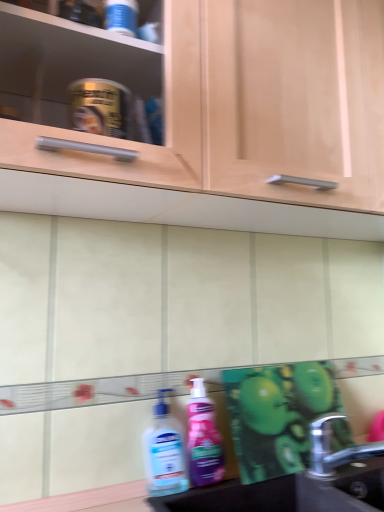
What do you see at coordinates (250, 104) in the screenshot?
I see `matte wood cabinet at upper center` at bounding box center [250, 104].

You are a GUI agent. You are given a task and a screenshot of the screen. Output one action in this format:
    pyautogui.click(x=<x>, y=<y>)
    Task: Click on the matte wood cabinet at upper center
    
    Given the screenshot: What is the action you would take?
    pyautogui.click(x=250, y=104)

Where is `pink glossy lotion at lower center, which is counted as the second cleaning product, starting from the left`? The width and height of the screenshot is (384, 512). pink glossy lotion at lower center, which is counted as the second cleaning product, starting from the left is located at coordinates (203, 438).

The height and width of the screenshot is (512, 384). Find the location of `translucent plastic hand sanitizer at lower center, arranged as the first cleaning product when viewed from the left`. translucent plastic hand sanitizer at lower center, arranged as the first cleaning product when viewed from the left is located at coordinates (164, 452).

Find the location of a particular element. This screenshot has width=384, height=512. matte wood cabinet at upper center is located at coordinates (250, 104).

Looking at the image, does translucent plastic hand sanitizer at lower center, which ranks as the 2th cleaning product in right-to-left order, seem bigger or smaller compared to silver metallic faucet at lower right?

translucent plastic hand sanitizer at lower center, which ranks as the 2th cleaning product in right-to-left order, is smaller than silver metallic faucet at lower right.

Looking at this image, from a real-world perspective, is translucent plastic hand sanitizer at lower center, arranged as the first cleaning product when viewed from the left, positioned under silver metallic faucet at lower right based on gravity?

No.

Is translucent plastic hand sanitizer at lower center, arranged as the first cleaning product when viewed from the left, inside or outside of silver metallic faucet at lower right?

translucent plastic hand sanitizer at lower center, arranged as the first cleaning product when viewed from the left, is not inside silver metallic faucet at lower right, it's outside.

Is translucent plastic hand sanitizer at lower center, which ranks as the 2th cleaning product in right-to-left order, shorter than silver metallic faucet at lower right?

No.

Does translucent plastic hand sanitizer at lower center, arranged as the first cleaning product when viewed from the left, come in front of pink glossy lotion at lower center, marked as the first cleaning product in a right-to-left arrangement?

Yes, the depth of translucent plastic hand sanitizer at lower center, arranged as the first cleaning product when viewed from the left, is less than that of pink glossy lotion at lower center, marked as the first cleaning product in a right-to-left arrangement.

Identify the location of cleaning product located above the translucent plastic hand sanitizer at lower center, arranged as the first cleaning product when viewed from the left (from a real-world perspective). The width and height of the screenshot is (384, 512). (203, 438).

Looking at this image, from the image's perspective, relative to pink glossy lotion at lower center, which is counted as the second cleaning product, starting from the left, is translucent plastic hand sanitizer at lower center, arranged as the first cleaning product when viewed from the left, above or below?

Clearly, from the image's perspective, translucent plastic hand sanitizer at lower center, arranged as the first cleaning product when viewed from the left, is below pink glossy lotion at lower center, which is counted as the second cleaning product, starting from the left.

Who is taller, translucent plastic hand sanitizer at lower center, which ranks as the 2th cleaning product in right-to-left order, or pink glossy lotion at lower center, marked as the first cleaning product in a right-to-left arrangement?

With more height is pink glossy lotion at lower center, marked as the first cleaning product in a right-to-left arrangement.

Which object is further away from the camera taking this photo, silver metallic faucet at lower right or matte wood cabinet at upper center?

silver metallic faucet at lower right is behind.

Is silver metallic faucet at lower right smaller than matte wood cabinet at upper center?

Yes, silver metallic faucet at lower right is smaller than matte wood cabinet at upper center.

Is translucent plastic hand sanitizer at lower center, arranged as the first cleaning product when viewed from the left, at the back of silver metallic faucet at lower right?

No.

From a real-world perspective, is silver metallic faucet at lower right on top of translucent plastic hand sanitizer at lower center, which ranks as the 2th cleaning product in right-to-left order?

No, from a real-world perspective, silver metallic faucet at lower right is not on top of translucent plastic hand sanitizer at lower center, which ranks as the 2th cleaning product in right-to-left order.

The image size is (384, 512). In order to click on tap on the right of the translucent plastic hand sanitizer at lower center, arranged as the first cleaning product when viewed from the left in this screenshot , I will do `click(331, 449)`.

Is silver metallic faucet at lower right completely or partially outside of pink glossy lotion at lower center, which is counted as the second cleaning product, starting from the left?

Absolutely, silver metallic faucet at lower right is external to pink glossy lotion at lower center, which is counted as the second cleaning product, starting from the left.

From the image's perspective, which one is positioned lower, silver metallic faucet at lower right or pink glossy lotion at lower center, marked as the first cleaning product in a right-to-left arrangement?

silver metallic faucet at lower right appears lower in the image.

From the picture: Is silver metallic faucet at lower right turned away from pink glossy lotion at lower center, which is counted as the second cleaning product, starting from the left?

silver metallic faucet at lower right is not turned away from pink glossy lotion at lower center, which is counted as the second cleaning product, starting from the left.

Can you tell me how much silver metallic faucet at lower right and pink glossy lotion at lower center, marked as the first cleaning product in a right-to-left arrangement, differ in facing direction?

The angle between the facing direction of silver metallic faucet at lower right and the facing direction of pink glossy lotion at lower center, marked as the first cleaning product in a right-to-left arrangement, is 5.1 degrees.

Consider the image. From a real-world perspective, is silver metallic faucet at lower right beneath black matte sink at lower right?

Actually, silver metallic faucet at lower right is physically above black matte sink at lower right in the real world.

How many degrees apart are the facing directions of silver metallic faucet at lower right and black matte sink at lower right?

The angular difference between silver metallic faucet at lower right and black matte sink at lower right is 0.18 degrees.

Who is bigger, silver metallic faucet at lower right or black matte sink at lower right?

With larger size is black matte sink at lower right.

Is black matte sink at lower right located within silver metallic faucet at lower right?

No, black matte sink at lower right is located outside of silver metallic faucet at lower right.

Is black matte sink at lower right surrounding matte wood cabinet at upper center?

No, matte wood cabinet at upper center is located outside of black matte sink at lower right.

Does black matte sink at lower right have a larger size compared to matte wood cabinet at upper center?

Actually, black matte sink at lower right might be smaller than matte wood cabinet at upper center.

Based on the photo, considering the positions of objects black matte sink at lower right and matte wood cabinet at upper center in the image provided, who is in front, black matte sink at lower right or matte wood cabinet at upper center?

matte wood cabinet at upper center is in front.

The image size is (384, 512). Find the location of `cleaning product that is the 1st object located above the silver metallic faucet at lower right (from the image's perspective)`. cleaning product that is the 1st object located above the silver metallic faucet at lower right (from the image's perspective) is located at coordinates (164, 452).

You are a GUI agent. You are given a task and a screenshot of the screen. Output one action in this format:
    pyautogui.click(x=<x>, y=<y>)
    Task: Click on the cleaning product below the pink glossy lotion at lower center, which is counted as the second cleaning product, starting from the left (from the image's perspective)
    The image size is (384, 512).
    Given the screenshot: What is the action you would take?
    pyautogui.click(x=164, y=452)

When comparing their distances from matte wood cabinet at upper center, does silver metallic faucet at lower right or black matte sink at lower right seem closer?

black matte sink at lower right lies closer to matte wood cabinet at upper center than the other object.

Based on their spatial positions, is silver metallic faucet at lower right or pink glossy lotion at lower center, which is counted as the second cleaning product, starting from the left, closer to black matte sink at lower right?

silver metallic faucet at lower right is closer to black matte sink at lower right.

Based on their spatial positions, is black matte sink at lower right or translucent plastic hand sanitizer at lower center, arranged as the first cleaning product when viewed from the left, closer to silver metallic faucet at lower right?

The object closer to silver metallic faucet at lower right is black matte sink at lower right.

Which object lies further to the anchor point pink glossy lotion at lower center, which is counted as the second cleaning product, starting from the left, silver metallic faucet at lower right or black matte sink at lower right?

silver metallic faucet at lower right is further to pink glossy lotion at lower center, which is counted as the second cleaning product, starting from the left.

Estimate the real-world distances between objects in this image. Which object is closer to translucent plastic hand sanitizer at lower center, which ranks as the 2th cleaning product in right-to-left order, black matte sink at lower right or matte wood cabinet at upper center?

black matte sink at lower right.

When comparing their distances from matte wood cabinet at upper center, does translucent plastic hand sanitizer at lower center, arranged as the first cleaning product when viewed from the left, or pink glossy lotion at lower center, marked as the first cleaning product in a right-to-left arrangement, seem closer?

Based on the image, pink glossy lotion at lower center, marked as the first cleaning product in a right-to-left arrangement, appears to be nearer to matte wood cabinet at upper center.

Considering their positions, is translucent plastic hand sanitizer at lower center, arranged as the first cleaning product when viewed from the left, positioned further to silver metallic faucet at lower right than pink glossy lotion at lower center, marked as the first cleaning product in a right-to-left arrangement?

translucent plastic hand sanitizer at lower center, arranged as the first cleaning product when viewed from the left, is positioned further to the anchor silver metallic faucet at lower right.

Considering their positions, is pink glossy lotion at lower center, marked as the first cleaning product in a right-to-left arrangement, positioned closer to black matte sink at lower right than silver metallic faucet at lower right?

The object closer to black matte sink at lower right is silver metallic faucet at lower right.

Locate an element on the screen. Image resolution: width=384 pixels, height=512 pixels. cleaning product between matte wood cabinet at upper center and translucent plastic hand sanitizer at lower center, arranged as the first cleaning product when viewed from the left, in the up-down direction is located at coordinates (203, 438).

Locate an element on the screen. This screenshot has width=384, height=512. cleaning product between translucent plastic hand sanitizer at lower center, which ranks as the 2th cleaning product in right-to-left order, and black matte sink at lower right, in the horizontal direction is located at coordinates (203, 438).

Image resolution: width=384 pixels, height=512 pixels. Identify the location of cleaning product located between translucent plastic hand sanitizer at lower center, arranged as the first cleaning product when viewed from the left, and silver metallic faucet at lower right in the left-right direction. (203, 438).

Locate an element on the screen. The height and width of the screenshot is (512, 384). sink between translucent plastic hand sanitizer at lower center, which ranks as the 2th cleaning product in right-to-left order, and silver metallic faucet at lower right, in the horizontal direction is located at coordinates (298, 484).